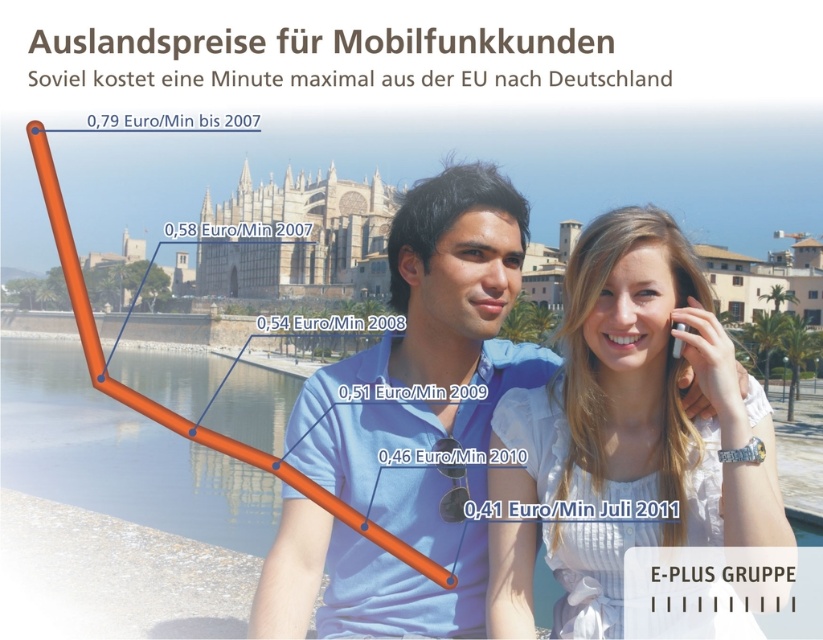
You are standing in front of the cathedral and want to take a photo of the light blue shirt at center and the white glossy phone at upper right. Which object should you focus on first to ensure both are in focus?

You should focus on the light blue shirt at center first because it is farther away from the viewer compared to the white glossy phone at upper right, ensuring both will be in focus when using depth of field.

You are designing a layout for a promotional poster and need to ensure the white glossy phone at upper right and the light blue shirt at center are placed appropriately. Given their sizes, which object should be positioned closer to the viewer to maintain visual balance?

The white glossy phone at upper right is thinner than the light blue shirt at center, so to maintain visual balance, the white glossy phone at upper right should be positioned closer to the viewer since it is smaller in size.